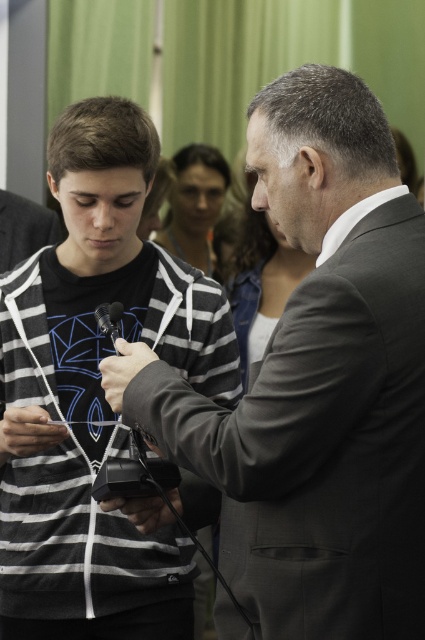
You are standing in front of the scene and want to locate the gray suit at center. What are the coordinates where you can find it?

The gray suit at center can be found at coordinates point (317, 381).

You are a photographer standing at the camera position. You need to adjust the focus to capture the gray suit at center clearly. What distance should you set the focus to?

The gray suit at center is 1.32 meters away from the camera, so you should set the focus distance to 1.32 meters to capture it clearly.